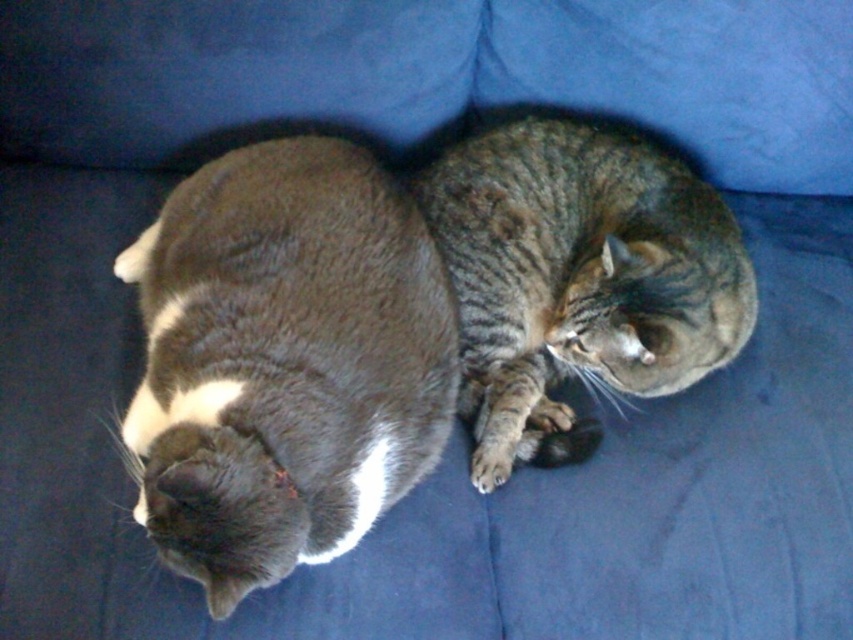
You are a cat owner who wants to pet your gray fur cat at center. You are standing 1.5 meters away from it. Can you reach it without moving closer?

The gray fur cat at center and viewer are 1.05 meters apart. Since you are 1.5 meters away, you are too far to reach it without moving closer.

You are a photographer trying to capture a closeup of the gray fur cat at center without the tabby fur cat at center blocking the view. Can you do this based on their positions?

The gray fur cat at center is closer to the viewer than the tabby fur cat at center, so you can take a closeup of the gray fur cat at center without the tabby fur cat at center blocking the view since it is behind the gray fur cat at center.